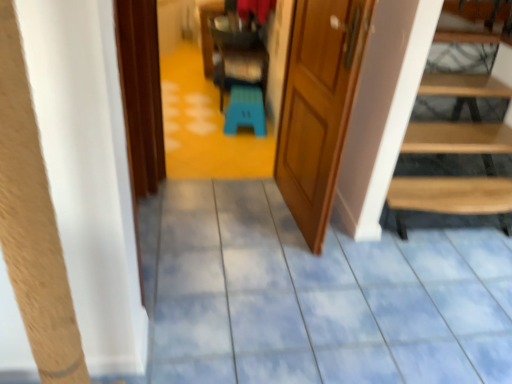
The width and height of the screenshot is (512, 384). I want to click on vacant area in front of wooden door at center, so click(287, 273).